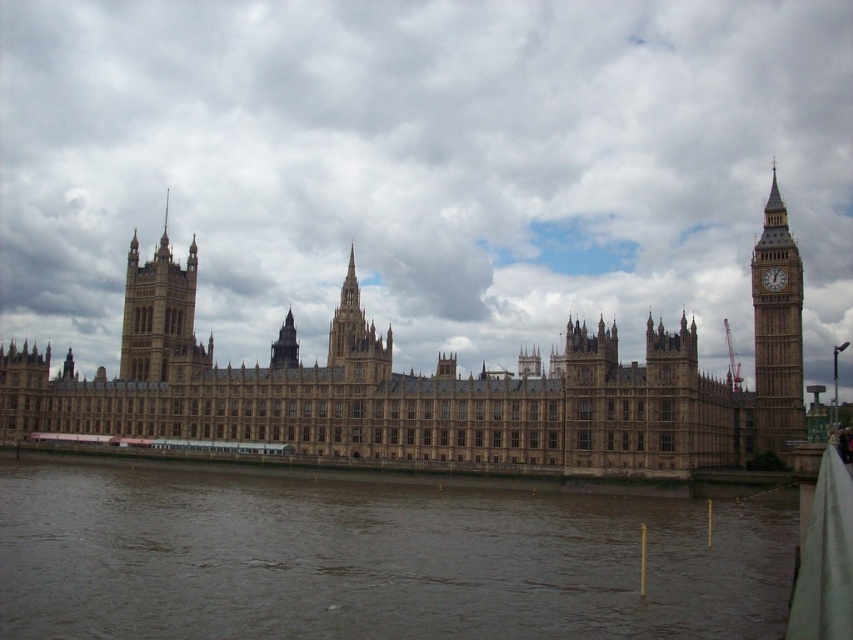
Question: Is brown stone castle at center to the left of golden stone clock tower at right from the viewer's perspective?

Choices:
 (A) no
 (B) yes

Answer: (B)

Question: Which object is closer to the camera taking this photo?

Choices:
 (A) gold metallic clock at right
 (B) brown stone castle at center
 (C) brown muddy water at lower left

Answer: (C)

Question: Is brown muddy water at lower left positioned at the back of golden stone clock tower at right?

Choices:
 (A) no
 (B) yes

Answer: (A)

Question: Where is brown stone tower at upper left located in relation to golden stone spire at center in the image?

Choices:
 (A) right
 (B) left

Answer: (B)

Question: Among these objects, which one is farthest from the camera?

Choices:
 (A) golden stone spire at center
 (B) brown muddy water at lower left
 (C) golden stone clock tower at right

Answer: (A)

Question: Which point is farther to the camera?

Choices:
 (A) (27, 396)
 (B) (146, 618)
 (C) (770, 273)

Answer: (A)